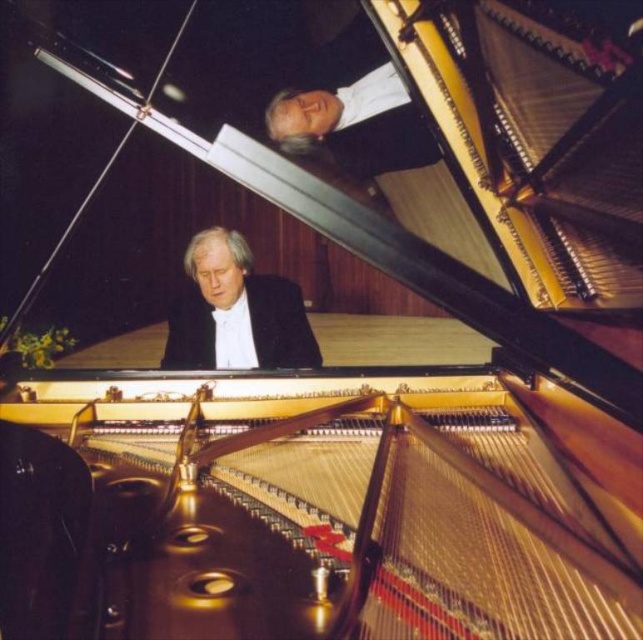
How far apart are matte black suit at center and white silk shirt at upper center?

A distance of 26.28 inches exists between matte black suit at center and white silk shirt at upper center.

Is point (199, 308) closer to camera compared to point (376, 83)?

No, it is behind (376, 83).

Measure the distance between matte black suit at center and camera.

matte black suit at center is 2.22 meters from camera.

Where is `matte black suit at center`? The width and height of the screenshot is (643, 640). matte black suit at center is located at coordinates (237, 312).